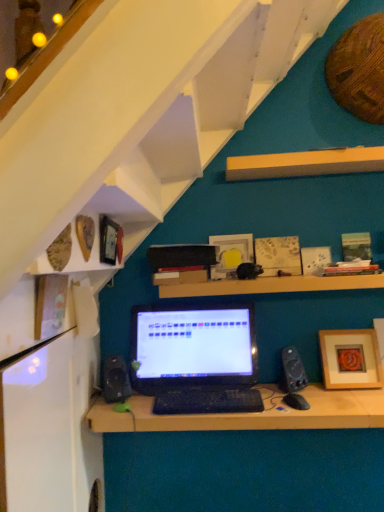
Question: Does black matte laptop at center have a lesser width compared to matte white picture frame at center, the third picture frame from the right?

Choices:
 (A) yes
 (B) no

Answer: (B)

Question: Is black matte laptop at center smaller than matte white picture frame at center, positioned as the fifth picture frame in front-to-back order?

Choices:
 (A) no
 (B) yes

Answer: (A)

Question: Can you confirm if black matte laptop at center is wider than matte white picture frame at center, which is the 1th picture frame in back-to-front order?

Choices:
 (A) yes
 (B) no

Answer: (A)

Question: From a real-world perspective, is black matte laptop at center on top of matte white picture frame at center, positioned as the fifth picture frame in front-to-back order?

Choices:
 (A) no
 (B) yes

Answer: (A)

Question: Is black matte laptop at center oriented away from matte white picture frame at center, placed as the 3th picture frame when sorted from left to right?

Choices:
 (A) yes
 (B) no

Answer: (B)

Question: In the image, is yellow wood shelf at upper center, positioned as the 3th shelf in bottom-to-top order, positioned in front of or behind wooden textured picture frame at upper center, the 4th picture frame positioned from the front?

Choices:
 (A) behind
 (B) front

Answer: (B)

Question: From the image's perspective, is yellow wood shelf at upper center, arranged as the 1th shelf when viewed from the top, located above or below wooden textured picture frame at upper center, the fourth picture frame viewed from the left?

Choices:
 (A) above
 (B) below

Answer: (A)

Question: From a real-world perspective, is yellow wood shelf at upper center, positioned as the 3th shelf in bottom-to-top order, physically located above or below wooden textured picture frame at upper center, the 2th picture frame positioned from the back?

Choices:
 (A) above
 (B) below

Answer: (A)

Question: Is point (292, 168) closer or farther from the camera than point (299, 272)?

Choices:
 (A) closer
 (B) farther

Answer: (A)

Question: Considering the positions of wooden textured picture frame at upper center, arranged as the second picture frame when viewed from the right, and black matte desk at center in the image, is wooden textured picture frame at upper center, arranged as the second picture frame when viewed from the right, bigger or smaller than black matte desk at center?

Choices:
 (A) big
 (B) small

Answer: (B)

Question: From the image's perspective, is wooden textured picture frame at upper center, the 4th picture frame positioned from the front, located above or below black matte desk at center?

Choices:
 (A) above
 (B) below

Answer: (A)

Question: Considering the positions of wooden textured picture frame at upper center, the 4th picture frame positioned from the front, and black matte desk at center in the image, is wooden textured picture frame at upper center, the 4th picture frame positioned from the front, wider or thinner than black matte desk at center?

Choices:
 (A) thin
 (B) wide

Answer: (A)

Question: Relative to black matte desk at center, is wooden textured picture frame at upper center, the 4th picture frame positioned from the front, in front or behind?

Choices:
 (A) front
 (B) behind

Answer: (B)

Question: From a real-world perspective, is wooden picture frame at lower right, the third picture frame positioned from the front, positioned above or below wooden textured picture frame at upper center, the fourth picture frame viewed from the left?

Choices:
 (A) below
 (B) above

Answer: (A)

Question: Do you think wooden picture frame at lower right, the third picture frame positioned from the front, is within wooden textured picture frame at upper center, the 4th picture frame positioned from the front, or outside of it?

Choices:
 (A) inside
 (B) outside

Answer: (B)